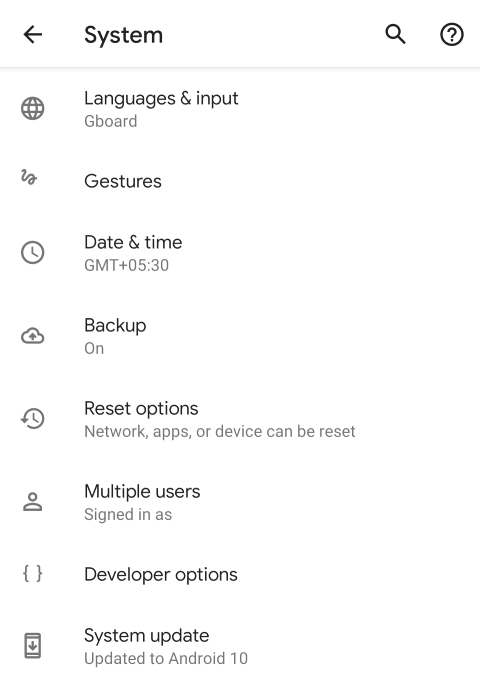
This screenshot has height=689, width=480. Find the location of `clock hands`. clock hands is located at coordinates (33, 418), (33, 249).